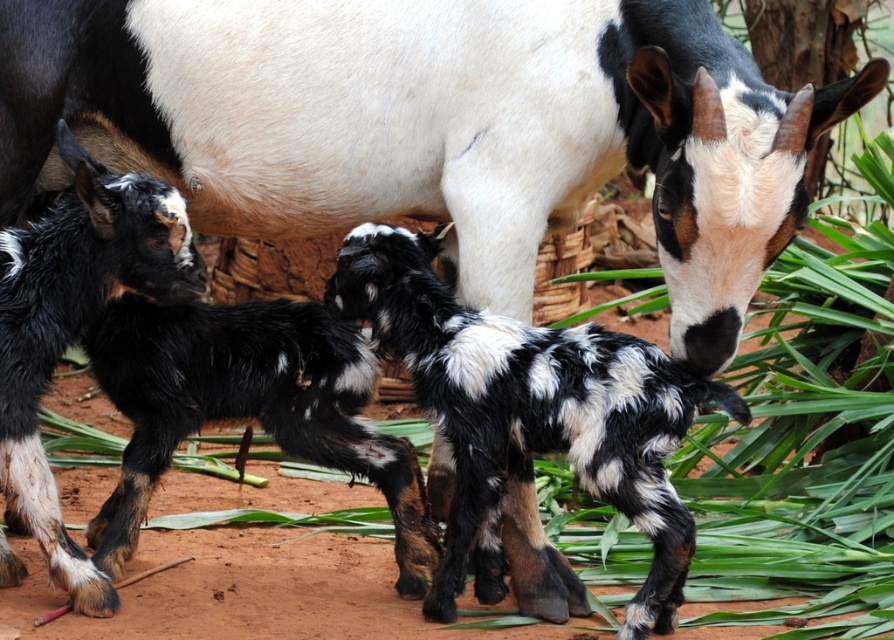
From the picture: You are a farmer observing the animals in the pasture. You notice the spotted fur calf at center and the spotted fur kid goat at left. Which animal is shorter in height?

The spotted fur calf at center is shorter than the spotted fur kid goat at left.

You are a farmer observing the animals in the pasture. You notice a spotted fur calf at center and a spotted fur kid goat at left. Which animal has a greater width?

The spotted fur calf at center has a greater width than the spotted fur kid goat at left.